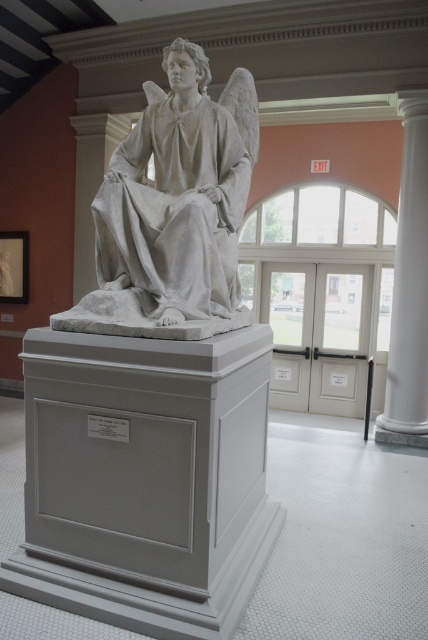
You are standing in the museum and want to take a photo of the white marble statue at center and the white marble column at right. Which object should you focus on first if you want to capture both in one shot without moving the camera?

You should focus on the white marble statue at center first because it is closer to you than the white marble column at right, so adjusting focus to the closer object will ensure both are in the frame.

You are a museum curator planning to install a protective glass case around the white marble statue at center. The case requires a minimum of 30 inches of space between the statue and any surrounding objects to ensure safety. Based on the current setup, will the white matte pedestal at center interfere with this requirement?

The white matte pedestal at center and white marble statue at center are 28.37 inches apart from each other. Since the required minimum space is 30 inches, the current distance is insufficient, so the white matte pedestal at center will interfere with the safety requirement.